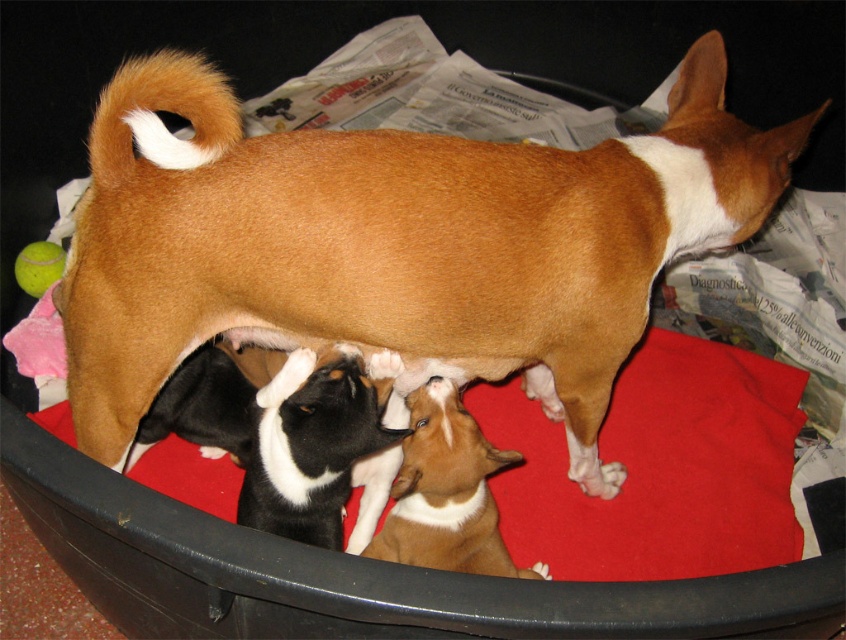
Question: Is brown smooth fur dog at center positioned at the back of brown smooth fur at center?

Choices:
 (A) no
 (B) yes

Answer: (A)

Question: Is brown smooth fur dog at center to the left of brown smooth fur at center from the viewer's perspective?

Choices:
 (A) yes
 (B) no

Answer: (A)

Question: Among these points, which one is farthest from the camera?

Choices:
 (A) (427, 464)
 (B) (217, 115)

Answer: (A)

Question: Observing the image, what is the correct spatial positioning of brown smooth fur dog at center in reference to brown smooth fur at center?

Choices:
 (A) above
 (B) below

Answer: (A)

Question: Which point is farther from the camera taking this photo?

Choices:
 (A) (423, 444)
 (B) (440, 144)

Answer: (A)